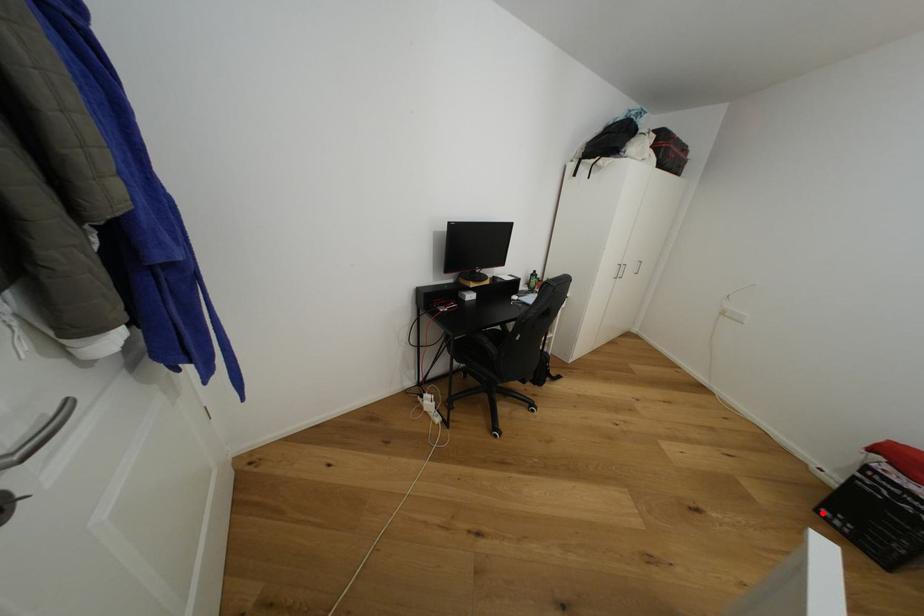
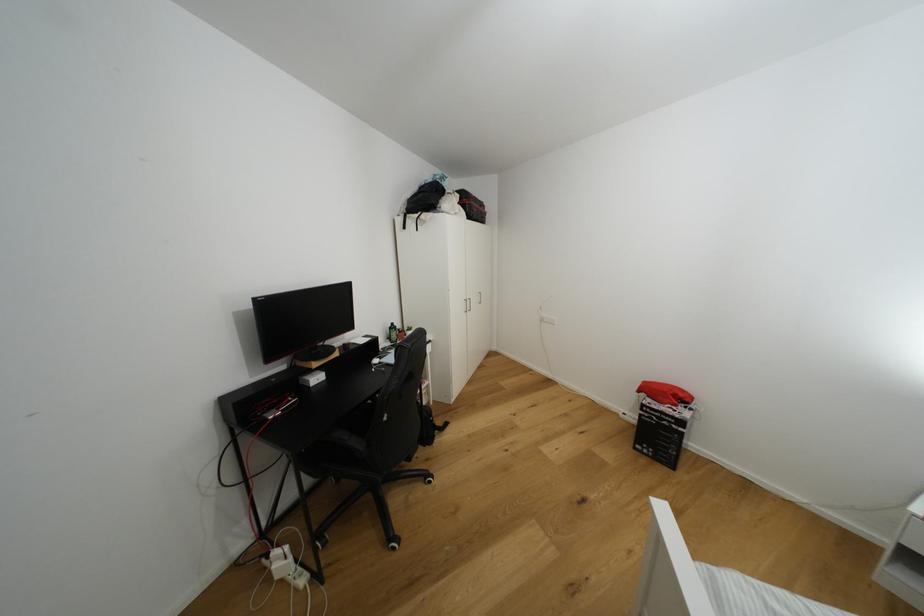
Question: I am providing you with two images of the same scene from different viewpoints. Given a red point in image1, look at the same physical point in image2. Is it:

Choices:
 (A) Closer to the viewpoint
 (B) Farther from the viewpoint

Answer: (B)